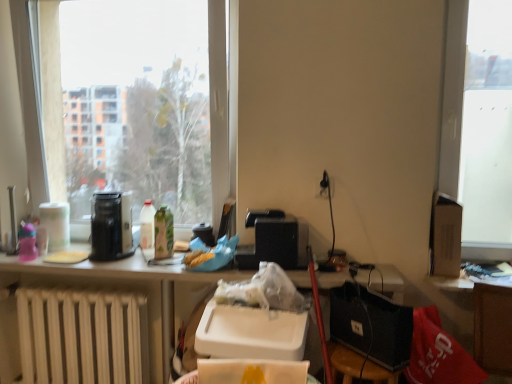
Question: Can you confirm if white glossy bottle at center, positioned as the 1th bottle in left-to-right order, is positioned to the right of wooden stool at lower right?

Choices:
 (A) yes
 (B) no

Answer: (B)

Question: Is white glossy bottle at center, placed as the second bottle when sorted from right to left, wider than wooden stool at lower right?

Choices:
 (A) yes
 (B) no

Answer: (B)

Question: Is white glossy bottle at center, placed as the second bottle when sorted from right to left, next to wooden stool at lower right?

Choices:
 (A) yes
 (B) no

Answer: (B)

Question: Is white glossy bottle at center, placed as the second bottle when sorted from right to left, bigger than wooden stool at lower right?

Choices:
 (A) yes
 (B) no

Answer: (B)

Question: From the image's perspective, would you say white glossy bottle at center, positioned as the 1th bottle in left-to-right order, is shown under wooden stool at lower right?

Choices:
 (A) no
 (B) yes

Answer: (A)

Question: Is wooden stool at lower right inside white glossy bottle at center, positioned as the 1th bottle in left-to-right order?

Choices:
 (A) no
 (B) yes

Answer: (A)

Question: Considering the relative sizes of green matte bottle at center, the first bottle viewed from the right, and white matte radiator at lower left in the image provided, is green matte bottle at center, the first bottle viewed from the right, bigger than white matte radiator at lower left?

Choices:
 (A) no
 (B) yes

Answer: (A)

Question: Can you confirm if green matte bottle at center, which appears as the 2th bottle when viewed from the left, is thinner than white matte radiator at lower left?

Choices:
 (A) yes
 (B) no

Answer: (A)

Question: From a real-world perspective, is green matte bottle at center, the first bottle viewed from the right, physically below white matte radiator at lower left?

Choices:
 (A) no
 (B) yes

Answer: (A)

Question: From a real-world perspective, is green matte bottle at center, which appears as the 2th bottle when viewed from the left, located higher than white matte radiator at lower left?

Choices:
 (A) yes
 (B) no

Answer: (A)

Question: Can we say green matte bottle at center, which appears as the 2th bottle when viewed from the left, lies outside white matte radiator at lower left?

Choices:
 (A) yes
 (B) no

Answer: (A)

Question: Is green matte bottle at center, which appears as the 2th bottle when viewed from the left, facing towards white matte radiator at lower left?

Choices:
 (A) no
 (B) yes

Answer: (A)

Question: From the image's perspective, is white matte radiator at lower left beneath green matte bottle at center, which appears as the 2th bottle when viewed from the left?

Choices:
 (A) yes
 (B) no

Answer: (A)